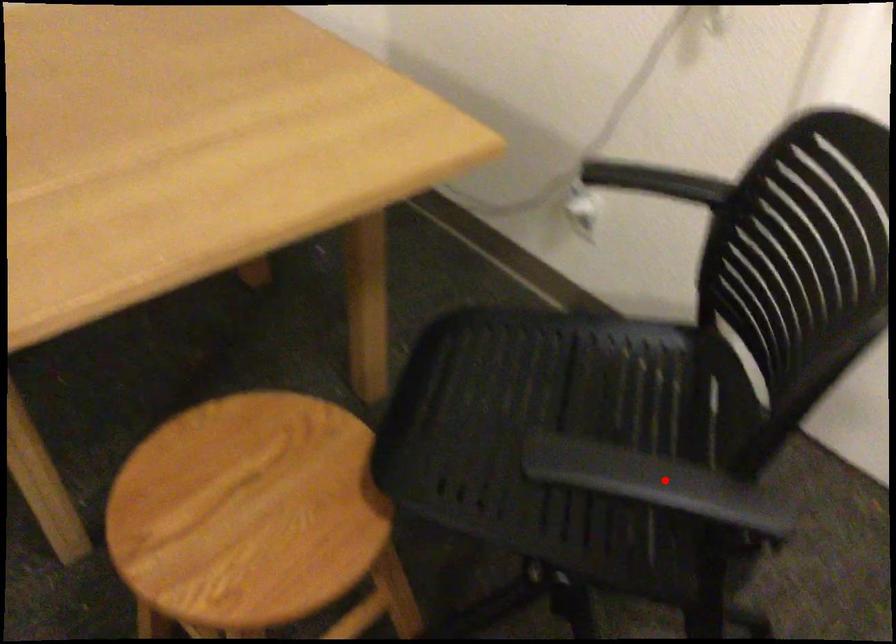
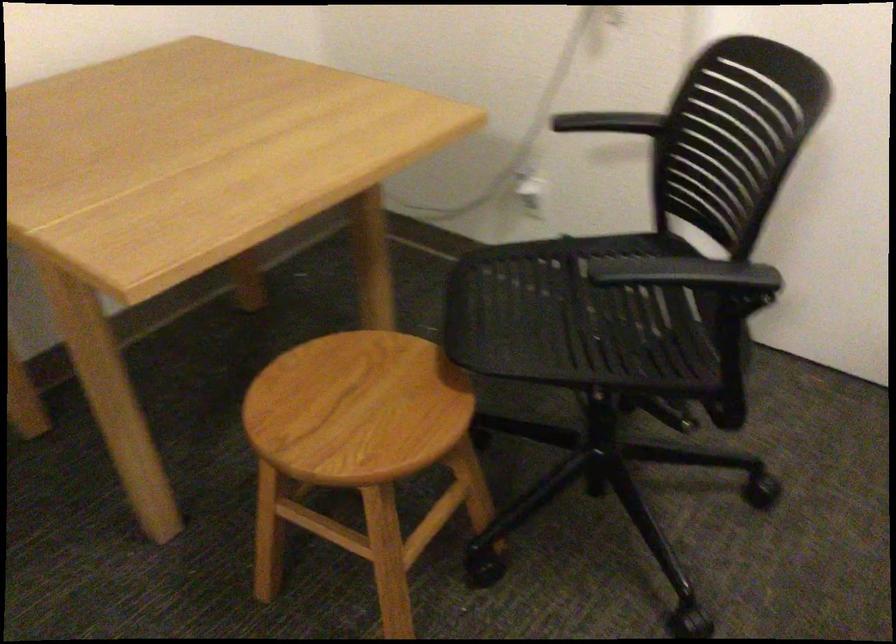
Where in the second image is the point corresponding to the highlighted location from the first image?

(685, 272)